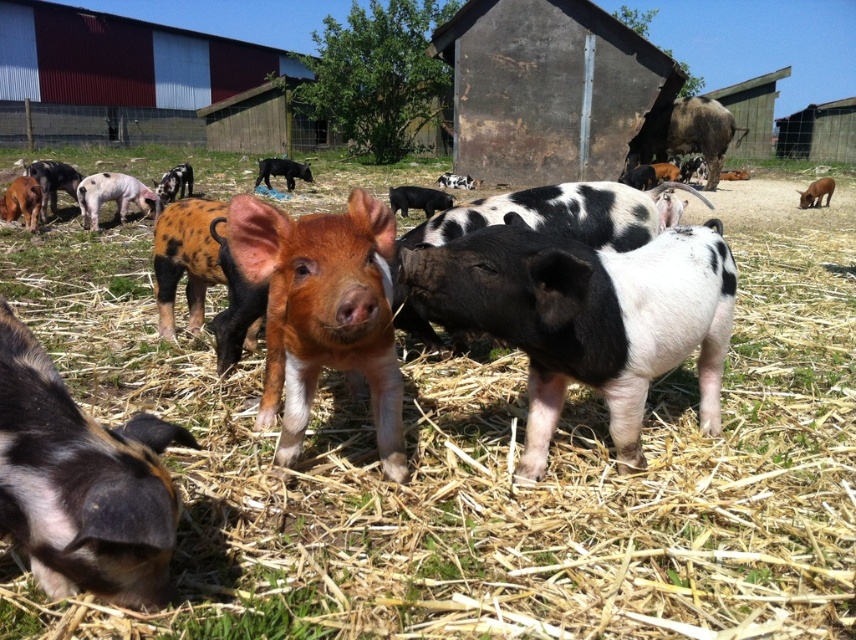
Question: Which point is farther to the camera?

Choices:
 (A) (269, 173)
 (B) (62, 403)
 (C) (34, 188)

Answer: (A)

Question: Which point appears closest to the camera in this image?

Choices:
 (A) (714, 182)
 (B) (143, 212)
 (C) (800, 208)
 (D) (292, 179)

Answer: (B)

Question: Observing the image, what is the correct spatial positioning of black and white speckled piglet at center in reference to brown furry piglet at center?

Choices:
 (A) above
 (B) below

Answer: (B)

Question: Can you confirm if black and white speckled piglet at center is smaller than brown furry piglet at center?

Choices:
 (A) no
 (B) yes

Answer: (B)

Question: Which object is positioned closest to the black and white speckled pig at center?

Choices:
 (A) black and white speckled piglet at center
 (B) brown speckled piglet at lower left
 (C) brown speckled piglet at center
 (D) white speckled piglet at left

Answer: (A)

Question: In this image, where is black and white speckled pig at center located relative to white speckled piglet at left?

Choices:
 (A) right
 (B) left

Answer: (A)